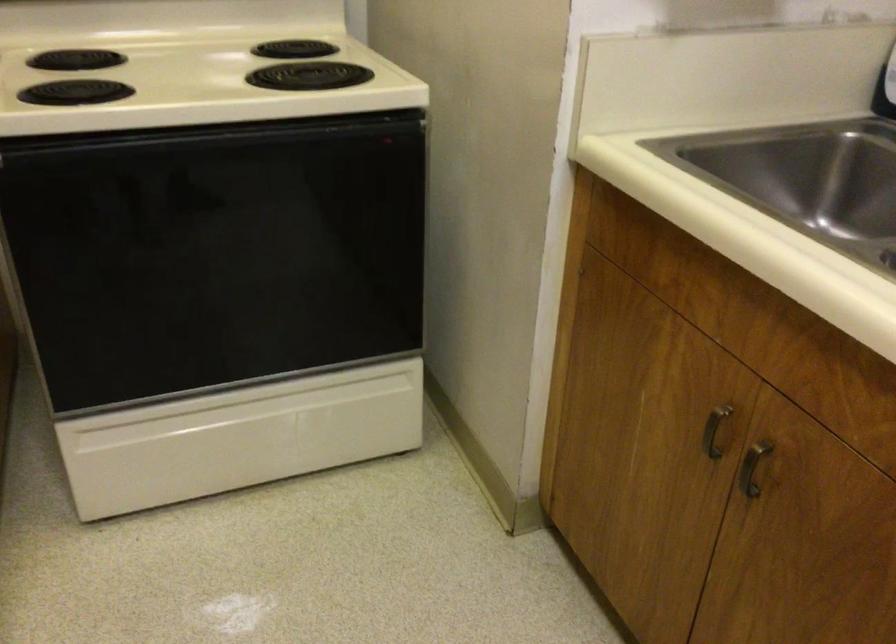
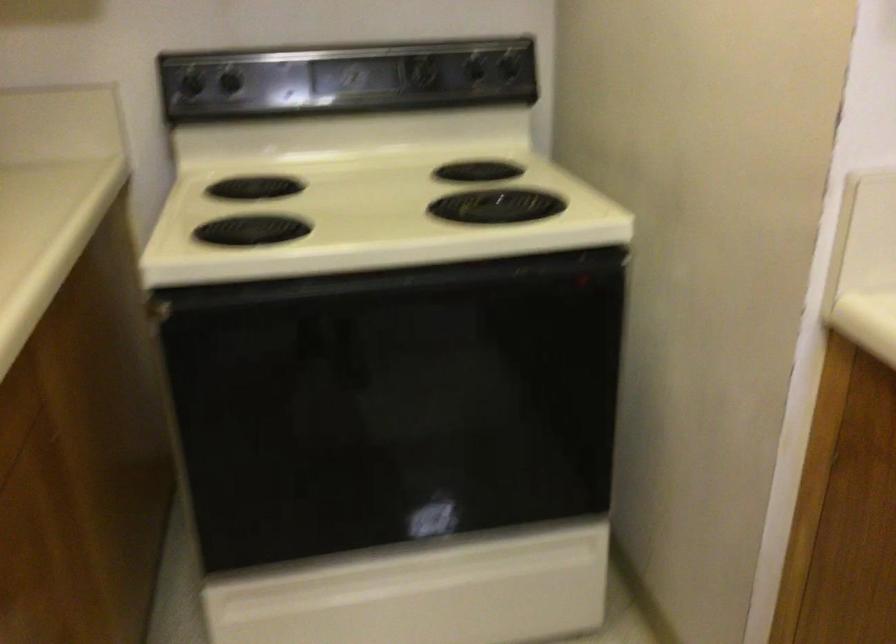
In a continuous first-person perspective shot, in which direction is the camera moving?

The cameraman moved toward left, forward.